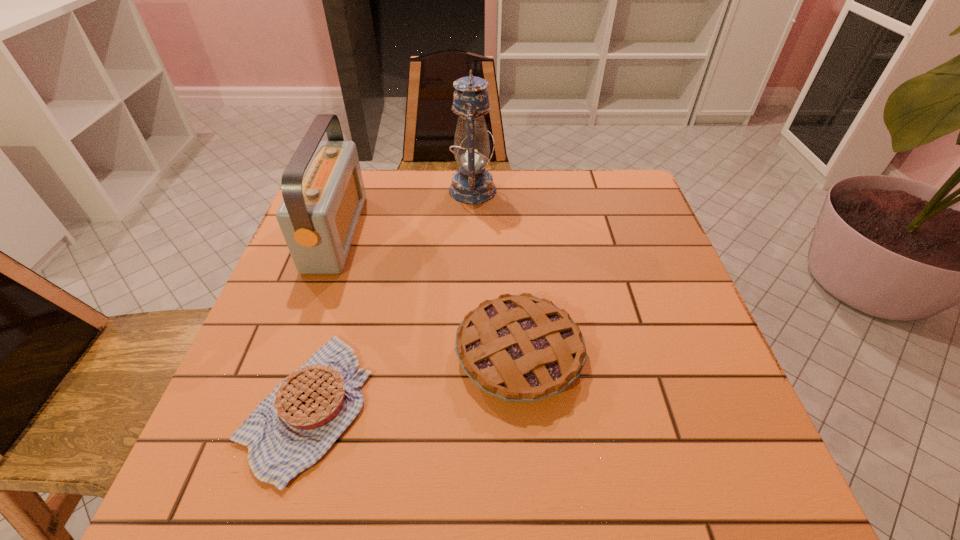
This screenshot has height=540, width=960. In the image, there is a desktop. What are the coordinates of `vacant region at the right edge` in the screenshot? It's located at (657, 435).

Locate an element on the screen. The image size is (960, 540). vacant area at the far right corner is located at coordinates (587, 185).

This screenshot has width=960, height=540. What are the coordinates of `free area in between the left pie and the tallest object` in the screenshot? It's located at (390, 298).

Where is `empty space that is in between the lantern and the shorter pie`? The image size is (960, 540). empty space that is in between the lantern and the shorter pie is located at coordinates (390, 298).

At what (x,y) coordinates should I click in order to perform the action: click on free space between the taller pie and the shortest object. Please return your answer as a coordinate pair (x, y). Looking at the image, I should click on (413, 380).

Where is `vacant area that lies between the third shortest object and the right pie`? The height and width of the screenshot is (540, 960). vacant area that lies between the third shortest object and the right pie is located at coordinates (427, 293).

This screenshot has height=540, width=960. In order to click on vacant area that lies between the radio receiver and the tallest object in this screenshot , I will do `click(404, 211)`.

This screenshot has height=540, width=960. Identify the location of vacant point located between the shorter pie and the third shortest object. (322, 319).

I want to click on free space between the shortest object and the taller pie, so click(x=413, y=380).

Find the location of `empty location between the tallest object and the right pie`. empty location between the tallest object and the right pie is located at coordinates (496, 272).